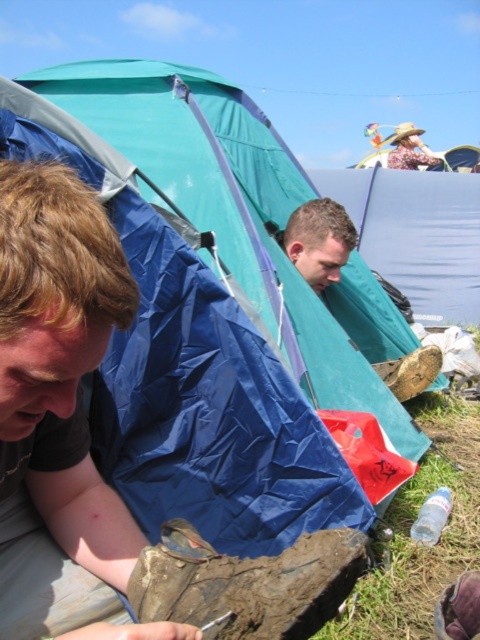
Question: Can you confirm if brown matte shoe at lower left is bigger than blue tarpaulin tent at left?

Choices:
 (A) no
 (B) yes

Answer: (A)

Question: Which of the following is the farthest from the observer?

Choices:
 (A) blue tarpaulin tent at left
 (B) brown matte shoe at lower left

Answer: (A)

Question: Among these objects, which one is farthest from the camera?

Choices:
 (A) blue tarpaulin tent at left
 (B) brown matte shoe at lower left

Answer: (A)

Question: Can you confirm if brown matte shoe at lower left is positioned to the left of blue tarpaulin tent at left?

Choices:
 (A) yes
 (B) no

Answer: (A)

Question: Is brown matte shoe at lower left to the right of blue tarpaulin tent at left from the viewer's perspective?

Choices:
 (A) no
 (B) yes

Answer: (A)